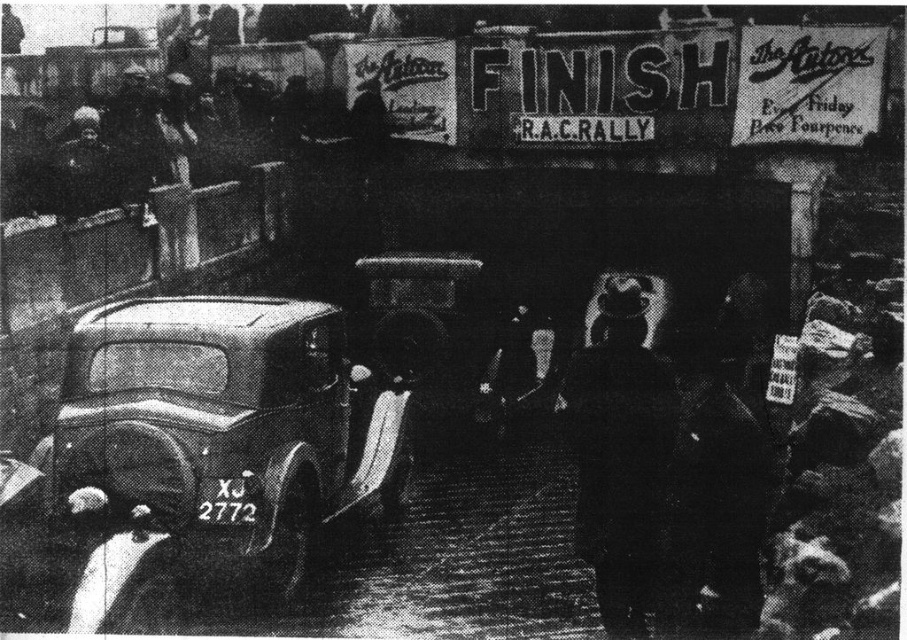
Question: Can you confirm if metallic silver car at center is thinner than dark wool coat at center?

Choices:
 (A) no
 (B) yes

Answer: (A)

Question: Which object is farther from the camera taking this photo?

Choices:
 (A) metallic silver car at center
 (B) dark wool coat at center

Answer: (B)

Question: Among these objects, which one is farthest from the camera?

Choices:
 (A) dark wool coat at center
 (B) metallic silver car at center

Answer: (A)

Question: Where is metallic silver car at center located in relation to dark wool coat at center in the image?

Choices:
 (A) right
 (B) left

Answer: (B)

Question: Can you confirm if metallic silver car at center is thinner than dark wool coat at center?

Choices:
 (A) yes
 (B) no

Answer: (B)

Question: Among these objects, which one is nearest to the camera?

Choices:
 (A) metallic silver car at center
 (B) dark wool coat at center

Answer: (A)